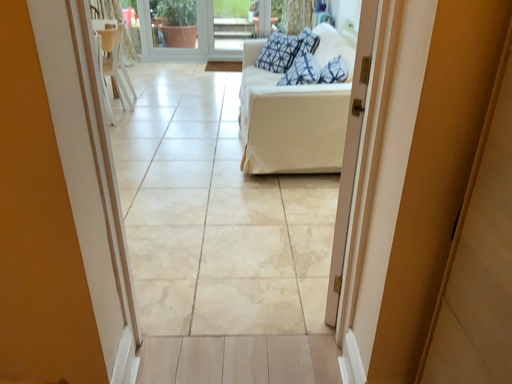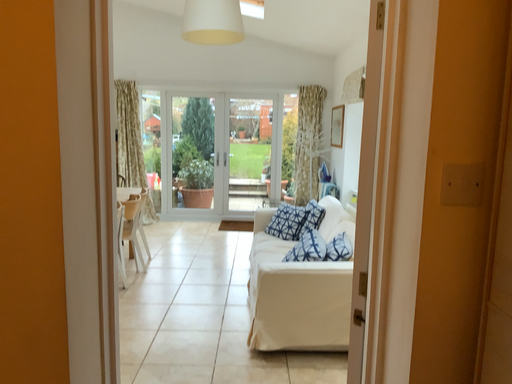
Question: How did the camera likely rotate when shooting the video?

Choices:
 (A) rotated upward
 (B) rotated downward

Answer: (A)